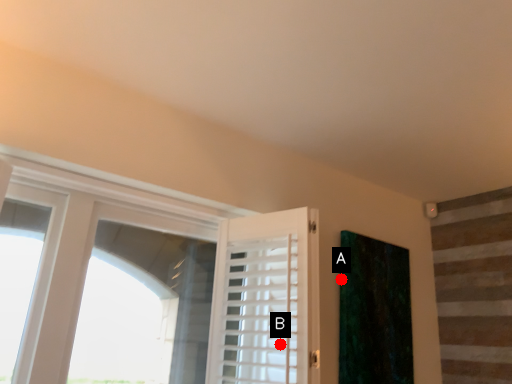
Question: Two points are circled on the image, labeled by A and B beside each circle. Which of the following is the farthest from the observer?

Choices:
 (A) A is further
 (B) B is further

Answer: (A)